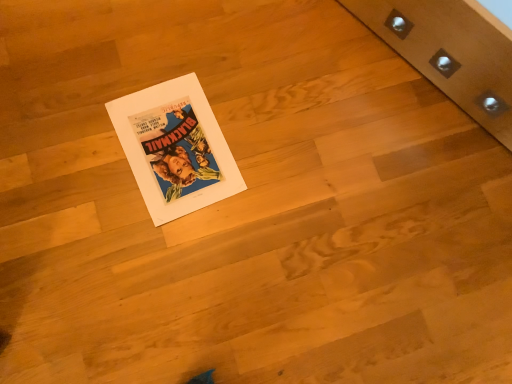
You are a GUI agent. You are given a task and a screenshot of the screen. Output one action in this format:
    pyautogui.click(x=<x>, y=<y>)
    Task: Click on the empty space that is ontop of matte paper poster at center (from a real-world perspective)
    Image resolution: width=512 pixels, height=384 pixels.
    Given the screenshot: What is the action you would take?
    pyautogui.click(x=174, y=144)